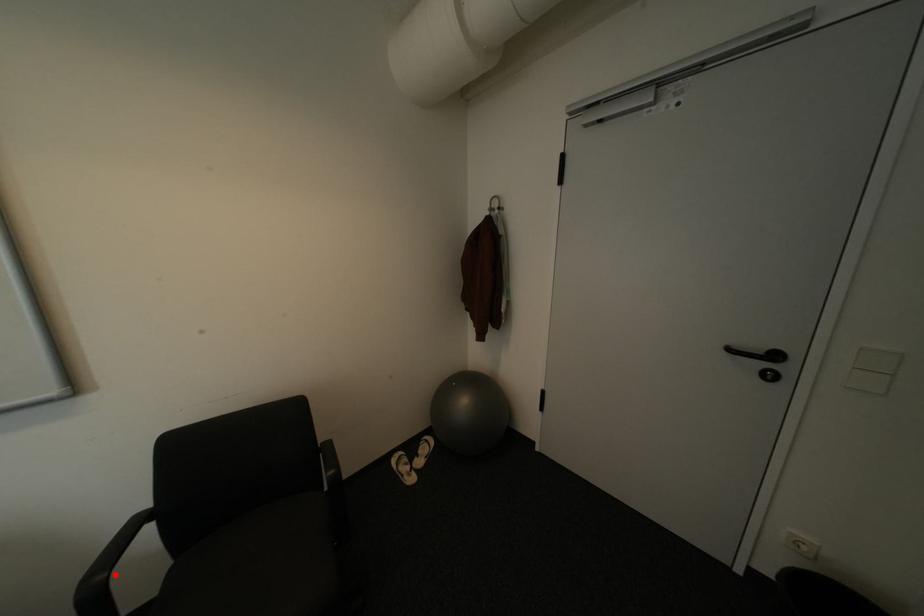
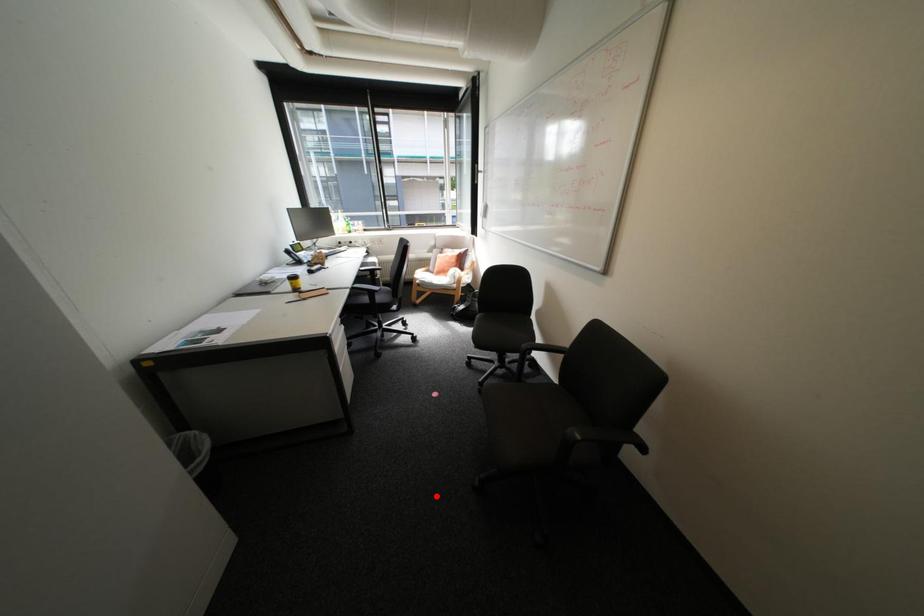
I am providing you with two images of the same scene from different viewpoints. A red point is marked on the first image and another point is marked on the second image. Is the marked point in image1 the same physical position as the marked point in image2?

No